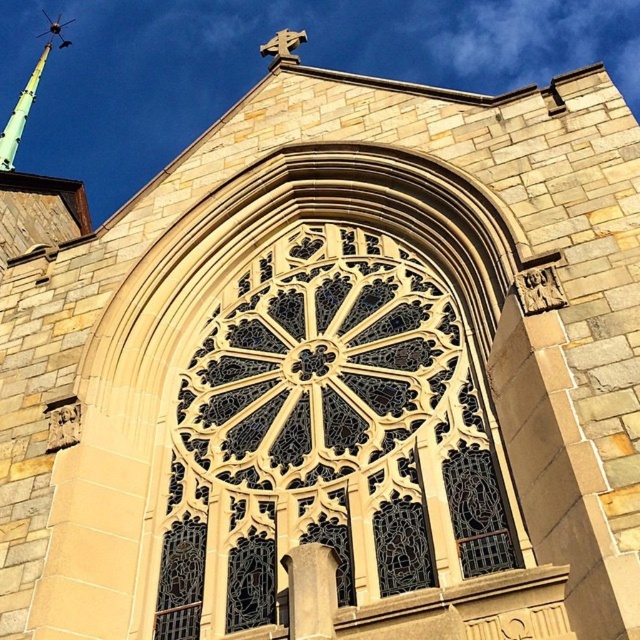
You are standing in front of the church and want to take a photo of the stained glass window at center and the green glass spire at upper left. Which object should you adjust your camera to focus on first if you want to capture both in the frame without moving the camera?

The stained glass window at center is to the right of the green glass spire at upper left, so you should focus on the green glass spire at upper left first to ensure both are in the frame.

You are an architect examining the church facade. You need to determine which object, the stained glass window at center or the green glass spire at upper left, requires more materials for restoration. Based on their sizes, which one would need more materials?

The green glass spire at upper left requires more materials for restoration because it is larger than the stained glass window at center.

You are standing in front of the church and want to take a photo of the stained glass window at center. If your camera can focus on objects up to 100 feet away, will it be able to capture the window clearly?

The stained glass window at center is 105.65 feet away from the camera, which is beyond the camera maximum focus range of 100 feet. Therefore, the camera will not be able to capture the window clearly.